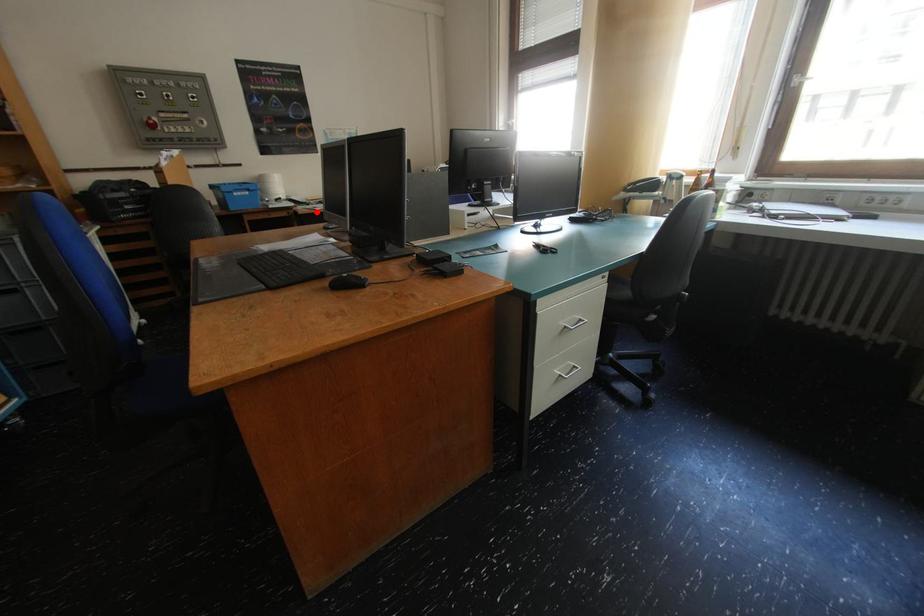
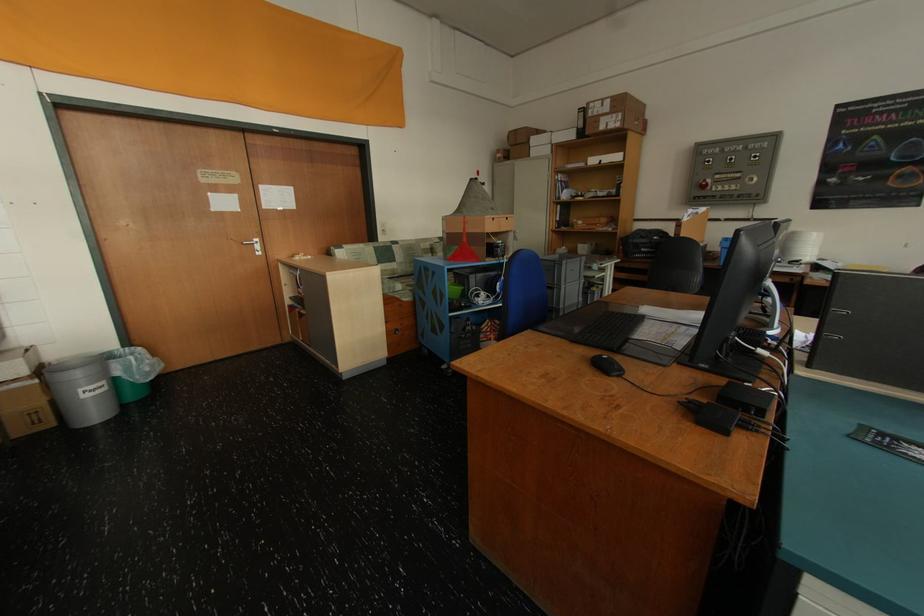
In the second image, find the point that corresponds to the highlighted location in the first image.

(832, 283)